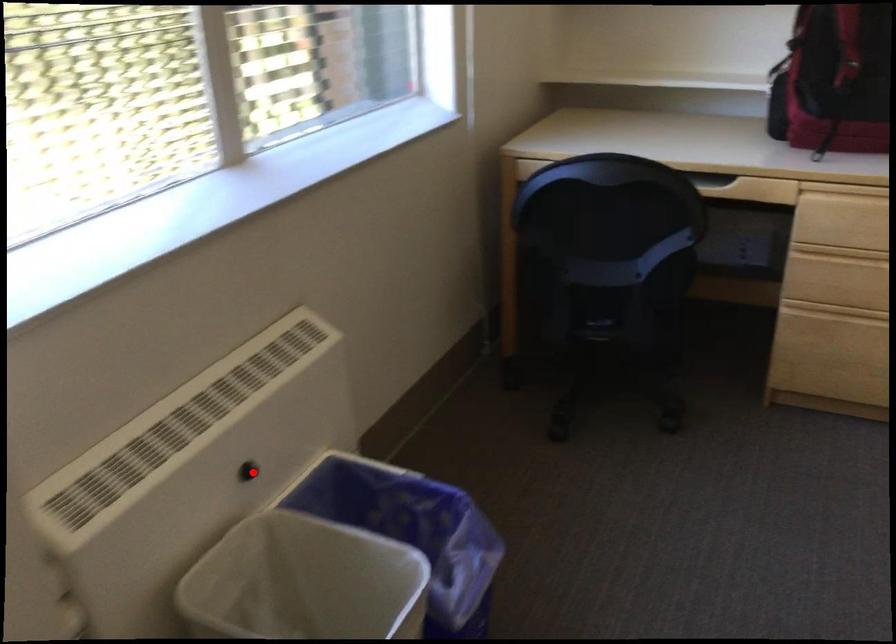
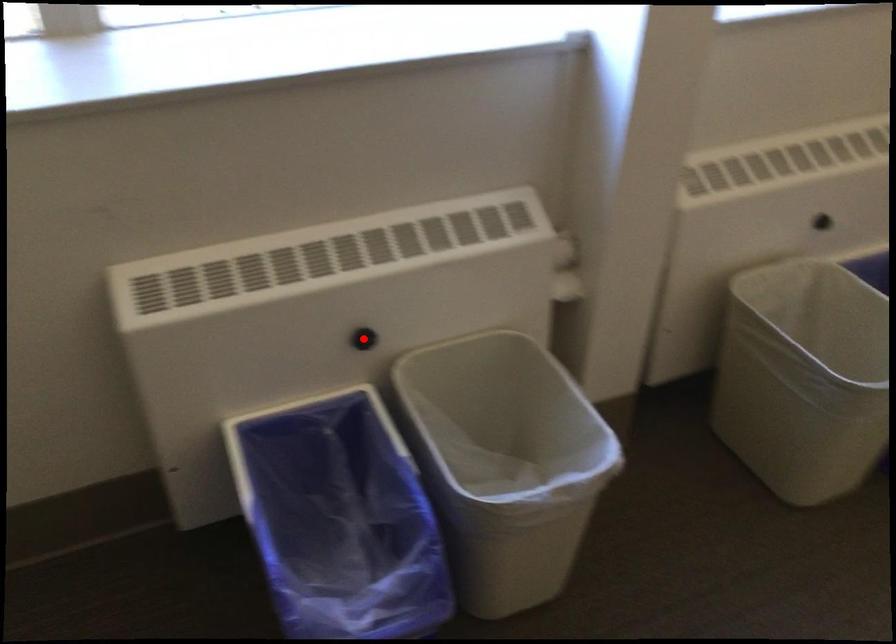
I am providing you with two images of the same scene from different viewpoints. A red point is marked on the first image and another point is marked on the second image. Are the points marked in image1 and image2 representing the same 3D position?

No